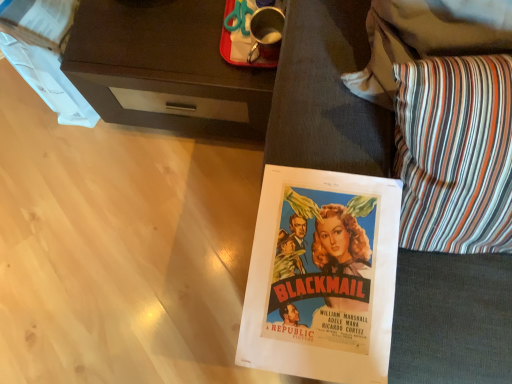
Where is `blank space situated above dark wood desk at upper left (from a real-world perspective)`? The image size is (512, 384). blank space situated above dark wood desk at upper left (from a real-world perspective) is located at coordinates (175, 34).